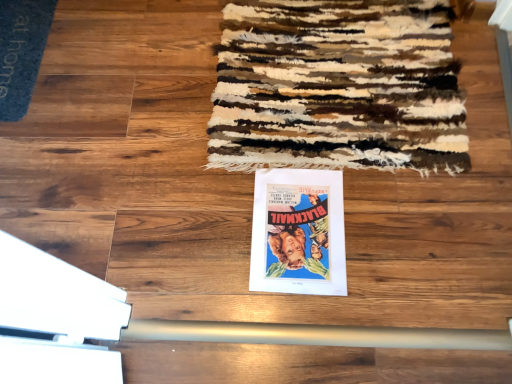
Locate an element on the screen. The image size is (512, 384). matte paper poster at center is located at coordinates (298, 233).

The image size is (512, 384). Find the location of `blue carpet at upper left`. blue carpet at upper left is located at coordinates (21, 52).

From a real-world perspective, is matte paper poster at center physically located above or below textured woolen mat at upper center?

Clearly, from a real-world perspective, matte paper poster at center is below textured woolen mat at upper center.

Considering the sizes of matte paper poster at center and textured woolen mat at upper center in the image, is matte paper poster at center bigger or smaller than textured woolen mat at upper center?

In the image, matte paper poster at center appears to be smaller than textured woolen mat at upper center.

How many degrees apart are the facing directions of matte paper poster at center and textured woolen mat at upper center?

There is a 0.547-degree angle between the facing directions of matte paper poster at center and textured woolen mat at upper center.

Is textured woolen mat at upper center at the back of matte paper poster at center?

Yes, matte paper poster at center is facing away from textured woolen mat at upper center.

Is textured woolen mat at upper center positioned beyond the bounds of matte paper poster at center?

Yes.

Which object is further away from the camera, textured woolen mat at upper center or matte paper poster at center?

textured woolen mat at upper center is more distant.

From a real-world perspective, between textured woolen mat at upper center and matte paper poster at center, who is vertically lower?

matte paper poster at center is physically lower.

Locate an element on the screen. Image resolution: width=512 pixels, height=384 pixels. mat lying on the right of matte paper poster at center is located at coordinates (338, 87).

Is matte paper poster at center next to blue carpet at upper left?

matte paper poster at center and blue carpet at upper left are not in contact.

At what (x,y) coordinates should I click in order to perform the action: click on doormat on the left side of matte paper poster at center. Please return your answer as a coordinate pair (x, y). The height and width of the screenshot is (384, 512). Looking at the image, I should click on (21, 52).

Is matte paper poster at center looking in the opposite direction of blue carpet at upper left?

matte paper poster at center is not turned away from blue carpet at upper left.

Considering the sizes of objects matte paper poster at center and blue carpet at upper left in the image provided, who is thinner, matte paper poster at center or blue carpet at upper left?

Thinner between the two is blue carpet at upper left.

How far apart are textured woolen mat at upper center and blue carpet at upper left?

A distance of 28.98 inches exists between textured woolen mat at upper center and blue carpet at upper left.

From a real-world perspective, between textured woolen mat at upper center and blue carpet at upper left, who is vertically higher?

From a 3D spatial view, textured woolen mat at upper center is above.

Considering the relative sizes of textured woolen mat at upper center and blue carpet at upper left in the image provided, is textured woolen mat at upper center shorter than blue carpet at upper left?

No, textured woolen mat at upper center is not shorter than blue carpet at upper left.

Considering the relative sizes of textured woolen mat at upper center and blue carpet at upper left in the image provided, is textured woolen mat at upper center smaller than blue carpet at upper left?

No, textured woolen mat at upper center is not smaller than blue carpet at upper left.

Looking at this image, from a real-world perspective, who is located lower, blue carpet at upper left or textured woolen mat at upper center?

blue carpet at upper left, from a real-world perspective.

Is blue carpet at upper left situated inside textured woolen mat at upper center or outside?

blue carpet at upper left exists outside the volume of textured woolen mat at upper center.

Considering the relative sizes of blue carpet at upper left and textured woolen mat at upper center in the image provided, is blue carpet at upper left bigger than textured woolen mat at upper center?

No, blue carpet at upper left is not bigger than textured woolen mat at upper center.

From the image's perspective, which one is positioned lower, blue carpet at upper left or textured woolen mat at upper center?

textured woolen mat at upper center.

Who is taller, blue carpet at upper left or matte paper poster at center?

blue carpet at upper left.

Based on the photo, from a real-world perspective, who is located lower, blue carpet at upper left or matte paper poster at center?

From a 3D spatial view, matte paper poster at center is below.

From the image's perspective, is blue carpet at upper left over matte paper poster at center?

Yes, from the image's perspective, blue carpet at upper left is above matte paper poster at center.

Which is farther, (30, 35) or (282, 203)?

The point (30, 35) is more distant.

Where is `poster located in front of the textured woolen mat at upper center`? The image size is (512, 384). poster located in front of the textured woolen mat at upper center is located at coordinates (298, 233).

The image size is (512, 384). I want to click on poster below the textured woolen mat at upper center (from a real-world perspective), so click(298, 233).

Considering their positions, is textured woolen mat at upper center positioned closer to blue carpet at upper left than matte paper poster at center?

The object closer to blue carpet at upper left is textured woolen mat at upper center.

Estimate the real-world distances between objects in this image. Which object is further from matte paper poster at center, blue carpet at upper left or textured woolen mat at upper center?

blue carpet at upper left lies further to matte paper poster at center than the other object.

Considering their positions, is matte paper poster at center positioned closer to textured woolen mat at upper center than blue carpet at upper left?

Based on the image, matte paper poster at center appears to be nearer to textured woolen mat at upper center.

In the scene shown: Estimate the real-world distances between objects in this image. Which object is further from matte paper poster at center, textured woolen mat at upper center or blue carpet at upper left?

Among the two, blue carpet at upper left is located further to matte paper poster at center.

Estimate the real-world distances between objects in this image. Which object is closer to blue carpet at upper left, matte paper poster at center or textured woolen mat at upper center?

textured woolen mat at upper center lies closer to blue carpet at upper left than the other object.

Considering their positions, is blue carpet at upper left positioned closer to textured woolen mat at upper center than matte paper poster at center?

matte paper poster at center.

Identify the location of poster situated between blue carpet at upper left and textured woolen mat at upper center from left to right. Image resolution: width=512 pixels, height=384 pixels. (298, 233).